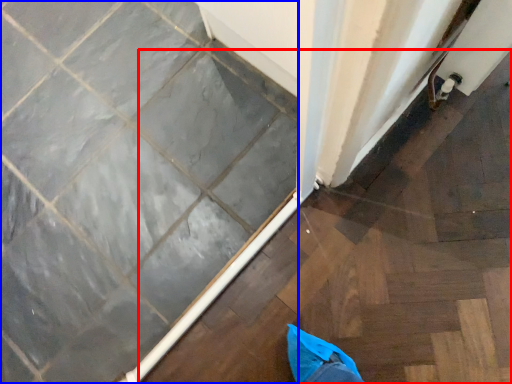
Question: Which object is further to the camera taking this photo, stairwell (highlighted by a red box) or ceramic tile (highlighted by a blue box)?

Choices:
 (A) stairwell
 (B) ceramic tile

Answer: (B)